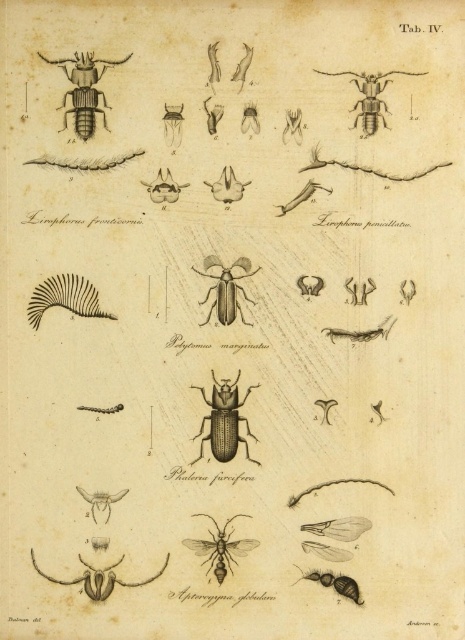
You are a researcher examining the botanical illustration labeled as Tab. IV. You notice two beetles in the image. The first is a black matte beetle at center, and the second is a matte black beetle at lower left. Based on their positions in the illustration, which beetle is located to the right of the other?

The black matte beetle at center is to the right of the matte black beetle at lower left.

Looking at this image, you are a researcher examining the botanical illustration labeled as Tab. IV. You need to determine the distance between the black matte beetle at center and the edge of the page to ensure proper framing for a presentation. Based on the illustration, can you estimate whether the beetle is closer to the center or the edge?

The black matte beetle at center is positioned exactly at the center of the illustration, so it is equally distant from all edges. However, the description states the beetle is 4.75 feet from the camera, which might refer to its size in the illustration rather than its position. For framing, ensure the beetle remains centered to maintain balance.

What are the coordinates of the black matte beetle at center?

The black matte beetle at center is located at coordinates point (224, 420).